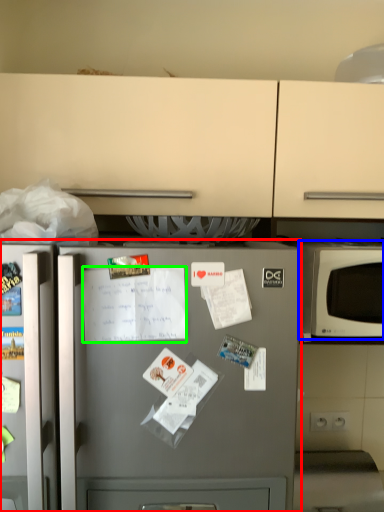
Question: Which object is positioned closest to refrigerator (highlighted by a red box)? Select from microwave oven (highlighted by a blue box) and receipt (highlighted by a green box).

Choices:
 (A) microwave oven
 (B) receipt

Answer: (B)